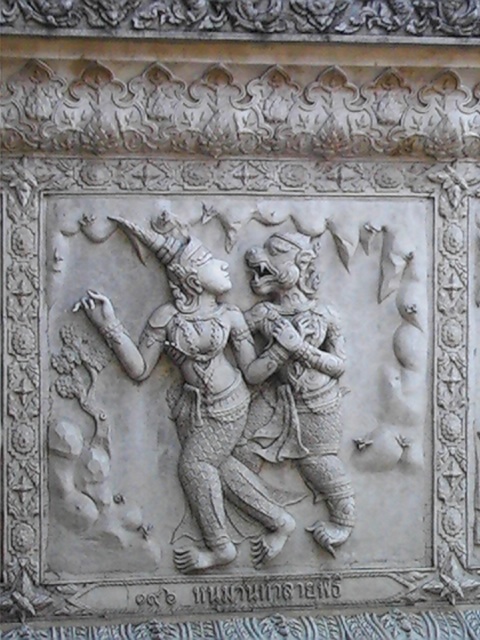
Question: Is white stone deity at center to the left of white stone demon at center from the viewer's perspective?

Choices:
 (A) no
 (B) yes

Answer: (B)

Question: Can you confirm if white stone deity at center is wider than white stone demon at center?

Choices:
 (A) no
 (B) yes

Answer: (B)

Question: Can you confirm if white stone deity at center is positioned below white stone demon at center?

Choices:
 (A) no
 (B) yes

Answer: (A)

Question: Among these points, which one is farthest from the camera?

Choices:
 (A) (297, 387)
 (B) (133, 356)

Answer: (A)

Question: Which point is farther to the camera?

Choices:
 (A) (311, 296)
 (B) (141, 372)

Answer: (A)